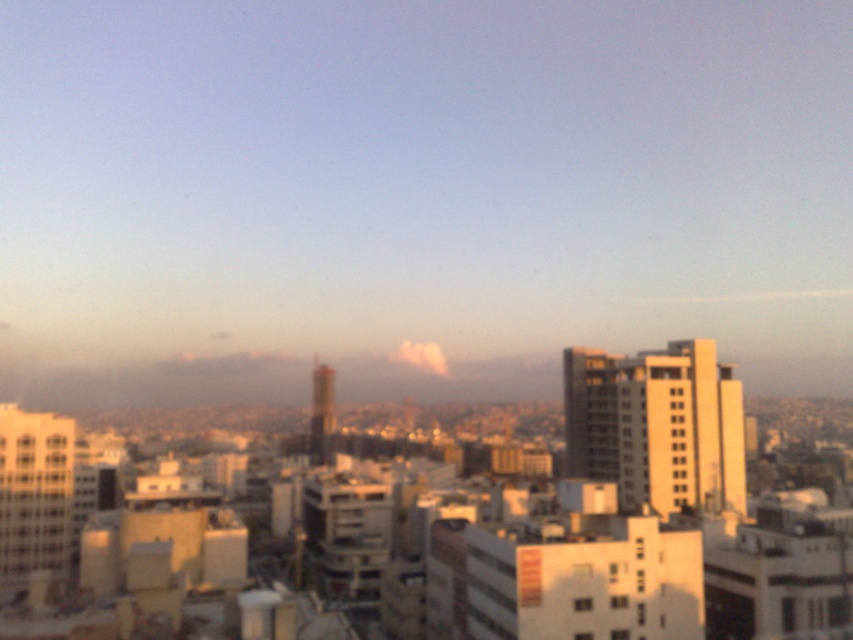
You are a city planner analyzing the urban layout. Given the white matte building at center and the yellow concrete building at right, which one has a greater horizontal span from left to right? Please base your answer on the spatial information provided in the scene.

The white matte building at center might be wider than yellow concrete building at right, so it has a greater horizontal span from left to right.

You are a city planner analyzing the urban layout. You need to determine the relative positions of the white matte building at center and the yellow concrete building at right. Which building is positioned to the left of the other?

The white matte building at center is to the left of the yellow concrete building at right.